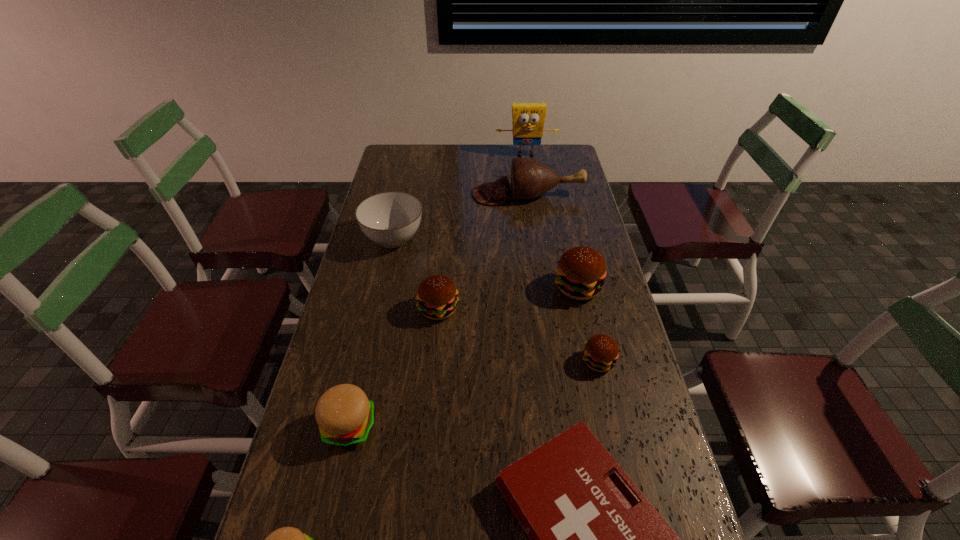
I want to click on yellow sponge, so click(528, 119).

The height and width of the screenshot is (540, 960). In order to click on the tallest object in this screenshot , I will do `click(528, 119)`.

You are a GUI agent. You are given a task and a screenshot of the screen. Output one action in this format:
    pyautogui.click(x=<x>, y=<y>)
    Task: Click on the ham
    This screenshot has width=960, height=540.
    Given the screenshot: What is the action you would take?
    pyautogui.click(x=530, y=179)

The image size is (960, 540). I want to click on the tallest hamburger, so click(x=581, y=271).

You are a GUI agent. You are given a task and a screenshot of the screen. Output one action in this format:
    pyautogui.click(x=<x>, y=<y>)
    Task: Click on the third farthest object
    
    Given the screenshot: What is the action you would take?
    pyautogui.click(x=390, y=219)

Find the location of a particular element. chinaware is located at coordinates (390, 219).

I want to click on the leftmost brown hamburger, so click(x=437, y=297).

At what (x,y) coordinates should I click in order to perform the action: click on the fourth object from left to right. Please return your answer as a coordinate pair (x, y). This screenshot has height=540, width=960. Looking at the image, I should click on (437, 297).

The width and height of the screenshot is (960, 540). I want to click on the bigger beige hamburger, so click(345, 416).

Find the location of `the second nearest hamburger`. the second nearest hamburger is located at coordinates (345, 416).